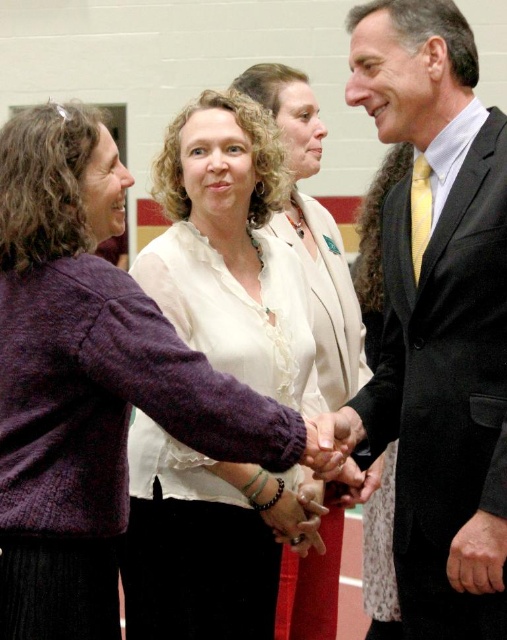
Looking at this image, you are a photographer taking a picture of the white satin blouse at center and the matte black bracelet at center. Which object will appear larger in your photo?

The white satin blouse at center will appear larger in the photo because it is closer to the viewer than the matte black bracelet at center.

You are standing in the gymnasium and notice two points marked on the floor. The first point is at coordinates point (478, 512) and the second is at point (315, 456). Which point is closer to you?

Point (478, 512) is closer to you because it is further to the viewer than point (315, 456).